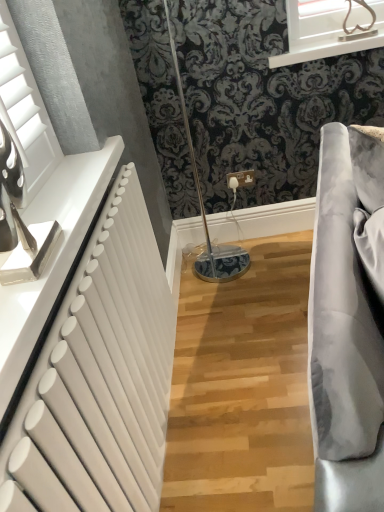
In order to face white matte radiator at left, should I rotate leftwards or rightwards?

Turn left approximately 8.497 degrees to face it.

This screenshot has width=384, height=512. What do you see at coordinates (99, 378) in the screenshot?
I see `white matte radiator at left` at bounding box center [99, 378].

Locate an element on the screen. white matte radiator at left is located at coordinates (99, 378).

Describe the element at coordinates (329, 29) in the screenshot. I see `white glossy frame at upper center` at that location.

At what (x,y) coordinates should I click in order to perform the action: click on white glossy frame at upper center. Please return your answer as a coordinate pair (x, y). Looking at the image, I should click on 329,29.

Image resolution: width=384 pixels, height=512 pixels. Find the location of `white matte radiator at left`. white matte radiator at left is located at coordinates (99, 378).

Is white glossy frame at upper center to the left of white matte radiator at left from the viewer's perspective?

In fact, white glossy frame at upper center is to the right of white matte radiator at left.

Considering the relative positions of white glossy frame at upper center and white matte radiator at left in the image provided, is white glossy frame at upper center in front of white matte radiator at left?

No.

Is point (341, 18) more distant than point (6, 442)?

Yes, point (341, 18) is farther from viewer.

From the image's perspective, who appears lower, white glossy frame at upper center or white matte radiator at left?

From the image's view, white matte radiator at left is below.

From a real-world perspective, between white glossy frame at upper center and white matte radiator at left, who is vertically lower?

white matte radiator at left.

Which of these two, white glossy frame at upper center or white matte radiator at left, is thinner?

white matte radiator at left is thinner.

Can you confirm if white glossy frame at upper center is taller than white matte radiator at left?

In fact, white glossy frame at upper center may be shorter than white matte radiator at left.

In terms of size, does white glossy frame at upper center appear bigger or smaller than white matte radiator at left?

In the image, white glossy frame at upper center appears to be smaller than white matte radiator at left.

Is white matte radiator at left a part of white glossy frame at upper center?

No, white matte radiator at left is not surrounded by white glossy frame at upper center.

Would you consider white glossy frame at upper center to be distant from white matte radiator at left?

white glossy frame at upper center is far away from white matte radiator at left.

Looking at this image, does white glossy frame at upper center turn towards white matte radiator at left?

No, white glossy frame at upper center is not facing towards white matte radiator at left.

What's the angular difference between white glossy frame at upper center and white matte radiator at left's facing directions?

90.1 degrees separate the facing orientations of white glossy frame at upper center and white matte radiator at left.

Find the location of a particular element. The height and width of the screenshot is (512, 384). window that is above the white matte radiator at left (from the image's perspective) is located at coordinates (329, 29).

Can you confirm if white matte radiator at left is positioned to the right of white glossy frame at upper center?

No.

Looking at this image, is white matte radiator at left closer to camera compared to white glossy frame at upper center?

Yes, white matte radiator at left is closer to the camera.

Which is closer, [73,418] or [308,3]?

Point [73,418] appears to be closer to the viewer than point [308,3].

From the image's perspective, does white matte radiator at left appear lower than white glossy frame at upper center?

Correct, white matte radiator at left appears lower than white glossy frame at upper center in the image.

From a real-world perspective, is white matte radiator at left positioned above or below white glossy frame at upper center?

In terms of real-world spatial position, white matte radiator at left is below white glossy frame at upper center.

In terms of width, does white matte radiator at left look wider or thinner when compared to white glossy frame at upper center?

white matte radiator at left is thinner than white glossy frame at upper center.

Is white matte radiator at left taller or shorter than white glossy frame at upper center?

Clearly, white matte radiator at left is taller compared to white glossy frame at upper center.

Is white matte radiator at left smaller than white glossy frame at upper center?

Incorrect, white matte radiator at left is not smaller in size than white glossy frame at upper center.

Is white glossy frame at upper center inside white matte radiator at left?

No, white glossy frame at upper center is not surrounded by white matte radiator at left.

Are white matte radiator at left and white glossy frame at upper center located far from each other?

Yes.

From the picture: Is white matte radiator at left aimed at white glossy frame at upper center?

No, white matte radiator at left is not turned towards white glossy frame at upper center.

How many degrees apart are the facing directions of white matte radiator at left and white glossy frame at upper center?

They differ by 90.1 degrees in their facing directions.

At what (x,y) coordinates should I click in order to perform the action: click on window located above the white matte radiator at left (from a real-world perspective). Please return your answer as a coordinate pair (x, y). This screenshot has height=512, width=384. Looking at the image, I should click on [x=329, y=29].

Find the location of a particular element. window above the white matte radiator at left (from the image's perspective) is located at coordinates (329, 29).

Image resolution: width=384 pixels, height=512 pixels. Find the location of `window that is on the right side of white matte radiator at left`. window that is on the right side of white matte radiator at left is located at coordinates (329, 29).